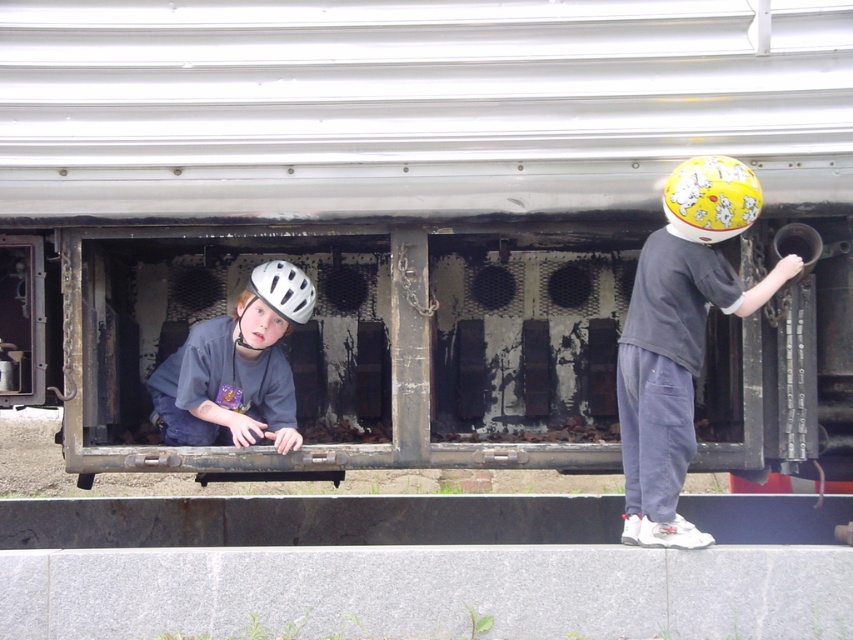
Question: Which object is farther from the camera taking this photo?

Choices:
 (A) yellow matte helmet at right
 (B) white matte safety helmet at left

Answer: (B)

Question: Is matte gray helmet at left positioned at the back of white matte safety helmet at left?

Choices:
 (A) no
 (B) yes

Answer: (A)

Question: Is matte gray helmet at left positioned at the back of yellow matte helmet at upper right?

Choices:
 (A) no
 (B) yes

Answer: (B)

Question: Does matte gray helmet at left have a larger size compared to white matte safety helmet at left?

Choices:
 (A) no
 (B) yes

Answer: (B)

Question: Which object is the closest to the yellow matte helmet at right?

Choices:
 (A) matte gray helmet at left
 (B) white matte safety helmet at left
 (C) yellow matte helmet at upper right

Answer: (C)

Question: Which of the following is the closest to the observer?

Choices:
 (A) (624, 372)
 (B) (268, 323)

Answer: (A)